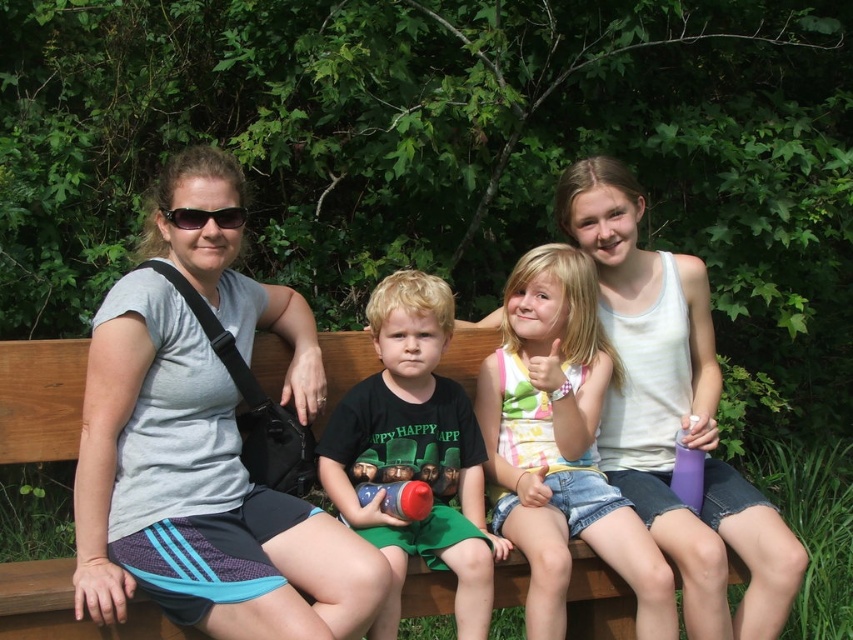
Based on the scene description, which of the two shirts, the gray fabric shirt at upper left or the green matte shirt at center, is positioned higher in the image?

The gray fabric shirt at upper left is taller than the green matte shirt at center, so it is positioned higher in the image.

You are a photographer standing in front of the bench. You want to take a photo of the striped cotton shirt at center and the green matte shirt at center. The minimum distance between the shirts required for your camera to focus on both is 10 inches. Will the shirts be in focus?

The striped cotton shirt at center and the green matte shirt at center are 11.31 inches apart, which is more than the required 10 inches, so both shirts will be in focus.

Based on the photo, you are a photographer trying to capture a closeup of the striped cotton shirt at center and the black plastic sunglasses at upper center. Which object should you focus on to ensure they both fit in the frame?

The striped cotton shirt at center is wider than the black plastic sunglasses at upper center, so focusing on the striped cotton shirt at center would ensure both objects fit in the frame.